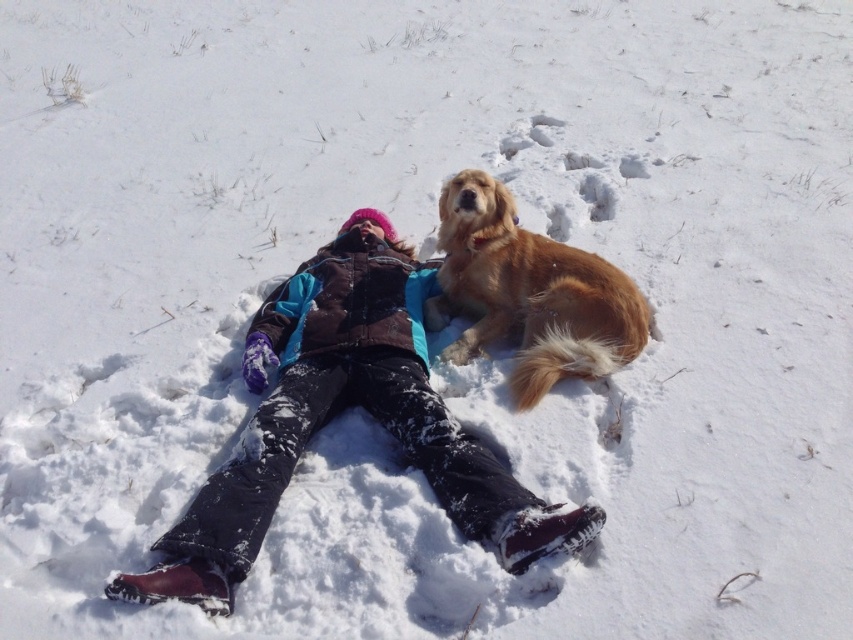
You are a photographer trying to capture a photo of the golden fur dog at upper right and the velvet brown jacket at center. From the photographer perspective, which object is positioned to the left?

The velvet brown jacket at center is positioned to the left of the golden fur dog at upper right.

You are a photographer trying to capture a photo of the velvet brown jacket at center and the golden fur dog at upper right. If you want to ensure both subjects are fully visible in the frame without cropping, which one should you position closer to the camera?

The velvet brown jacket at center might be wider than golden fur dog at upper right, so you should position the velvet brown jacket at center closer to the camera to ensure it fits within the frame.